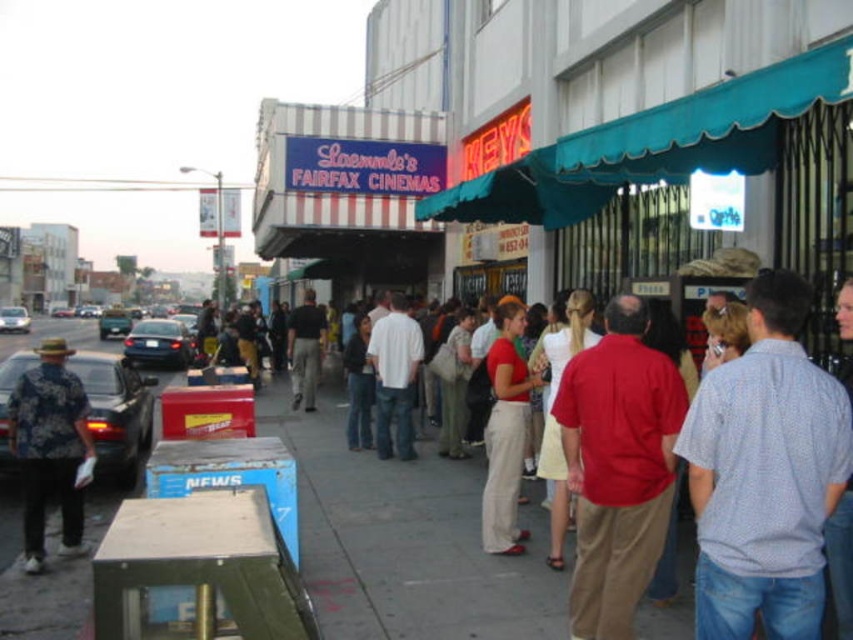
Consider the image. Is white cotton shirt at center taller than dark gray pants at center?

No, white cotton shirt at center is not taller than dark gray pants at center.

The height and width of the screenshot is (640, 853). Describe the element at coordinates (395, 376) in the screenshot. I see `white cotton shirt at center` at that location.

What do you see at coordinates (395, 376) in the screenshot? This screenshot has width=853, height=640. I see `white cotton shirt at center` at bounding box center [395, 376].

What are the coordinates of `white cotton shirt at center` in the screenshot? It's located at (395, 376).

Which is below, matte red blouse at center or dark gray pants at center?

matte red blouse at center is lower down.

At what (x,y) coordinates should I click in order to perform the action: click on matte red blouse at center. Please return your answer as a coordinate pair (x, y). Looking at the image, I should click on (505, 433).

Which is more to the right, light blue dotted shirt at center-right or shiny black sedan at center-left?

light blue dotted shirt at center-right is more to the right.

Between point (750, 458) and point (120, 317), which one is positioned in front?

Point (750, 458)

At what (x,y) coordinates should I click in order to perform the action: click on light blue dotted shirt at center-right. Please return your answer as a coordinate pair (x, y). This screenshot has height=640, width=853. Looking at the image, I should click on (764, 474).

I want to click on light blue dotted shirt at center-right, so click(764, 474).